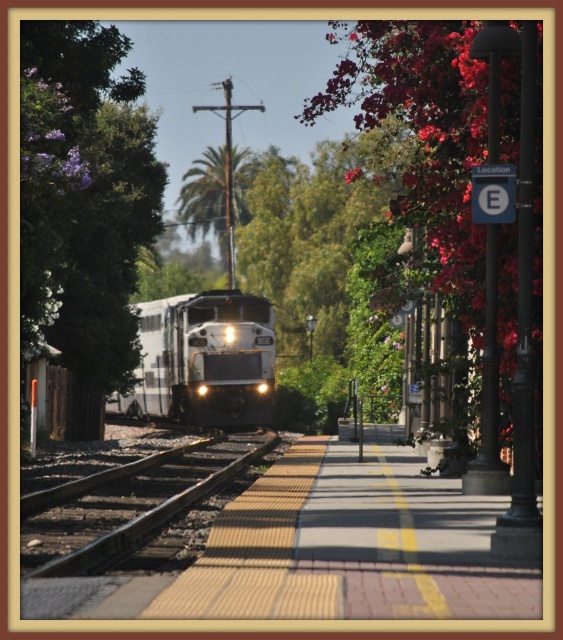
Which is more to the left, purple leafy tree at left or vivid pink flowers at right?

purple leafy tree at left

Between point (81, 163) and point (363, 52), which one is positioned in front?

Point (81, 163) is more forward.

Between point (70, 131) and point (361, 83), which one is positioned in front?

Point (70, 131) is more forward.

I want to click on purple leafy tree at left, so click(x=83, y=196).

Is purple leafy tree at left to the right of green leafy palm at center from the viewer's perspective?

Indeed, purple leafy tree at left is positioned on the right side of green leafy palm at center.

You are a GUI agent. You are given a task and a screenshot of the screen. Output one action in this format:
    pyautogui.click(x=<x>, y=<y>)
    Task: Click on the purple leafy tree at left
    
    Given the screenshot: What is the action you would take?
    pyautogui.click(x=83, y=196)

The image size is (563, 640). Find the location of `purple leafy tree at left`. purple leafy tree at left is located at coordinates (83, 196).

Between vivid pink flowers at right and black asphalt train track at center, which one appears on the right side from the viewer's perspective?

vivid pink flowers at right is more to the right.

Is vivid pink flowers at right taller than black asphalt train track at center?

Yes.

Does point (462, 179) lie behind point (110, 525)?

Yes.

Identify the location of vivid pink flowers at right. This screenshot has height=640, width=563. (453, 156).